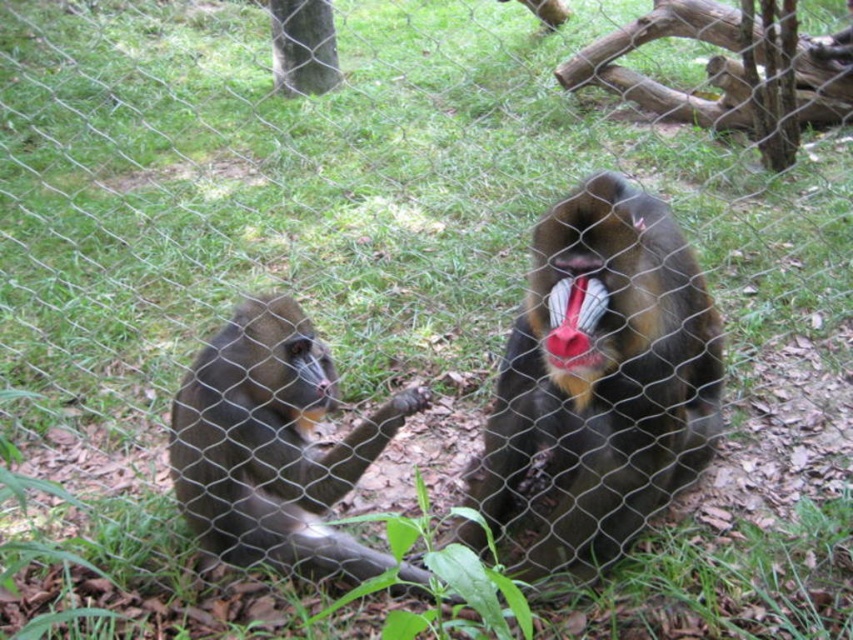
Looking at this image, is shiny brown monkey at center to the left of bright red fur at mouth right from the viewer's perspective?

No, shiny brown monkey at center is not to the left of bright red fur at mouth right.

Does shiny brown monkey at center lie in front of bright red fur at mouth right?

Yes, it is in front of bright red fur at mouth right.

Who is more distant from viewer, (x=581, y=376) or (x=560, y=360)?

Positioned behind is point (x=581, y=376).

At what (x,y) coordinates should I click in order to perform the action: click on shiny brown monkey at center. Please return your answer as a coordinate pair (x, y). This screenshot has width=853, height=640. Looking at the image, I should click on (602, 374).

Can you confirm if shiny brown monkey at center is smaller than brown furry monkey at left?

No.

Who is more forward, (625, 317) or (207, 531)?

Point (625, 317)

Measure the distance between point (596,454) and camera.

The distance of point (596,454) from camera is 7.10 feet.

What are the coordinates of `shiny brown monkey at center` in the screenshot? It's located at (602, 374).

Is brown furry monkey at left to the right of bright red fur at mouth right from the viewer's perspective?

In fact, brown furry monkey at left is to the left of bright red fur at mouth right.

Measure the distance between point (366, 435) and camera.

Point (366, 435) and camera are 2.28 meters apart.

What do you see at coordinates (271, 445) in the screenshot?
I see `brown furry monkey at left` at bounding box center [271, 445].

Identify the location of brown furry monkey at left. The width and height of the screenshot is (853, 640). (271, 445).